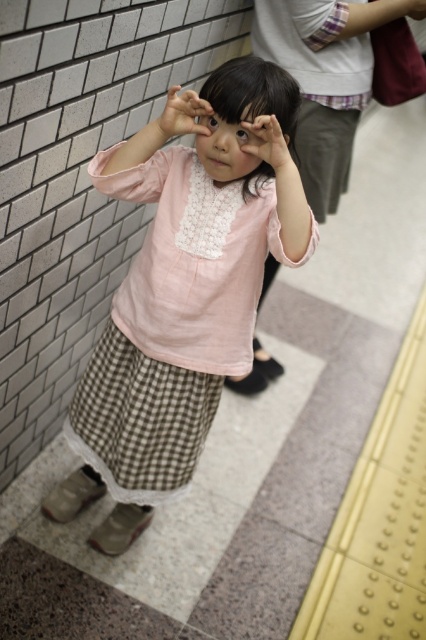
Between black glossy eye at center and brown matte eye at center, which one has more height?

black glossy eye at center is taller.

Is black glossy eye at center to the left of brown matte eye at center from the viewer's perspective?

Incorrect, black glossy eye at center is not on the left side of brown matte eye at center.

Is point (244, 138) positioned after point (213, 122)?

No, (244, 138) is closer to viewer.

I want to click on black glossy eye at center, so click(x=241, y=134).

Is matte pink shirt at center bigger than black glossy eye at center?

Yes.

Which of these two, matte pink shirt at center or black glossy eye at center, stands taller?

matte pink shirt at center is taller.

Which is behind, point (279, 177) or point (242, 131)?

Positioned behind is point (242, 131).

Image resolution: width=426 pixels, height=640 pixels. I want to click on matte pink shirt at center, so click(267, 144).

Is point (167, 456) closer to camera compared to point (166, 118)?

No, it is behind (166, 118).

Who is more distant from viewer, (242, 81) or (199, 108)?

The point (242, 81) is more distant.

Where is `pink cotton shirt at center`? This screenshot has width=426, height=640. pink cotton shirt at center is located at coordinates (181, 300).